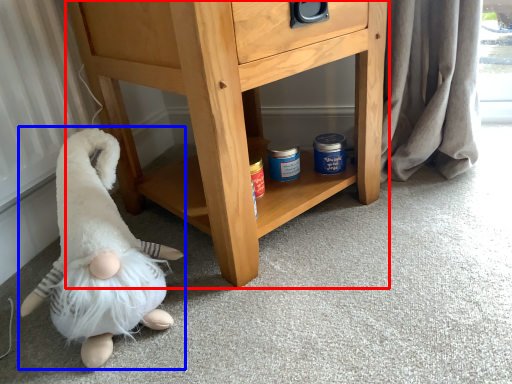
Question: Which of the following is the farthest to the observer, chest of drawers (highlighted by a red box) or toy (highlighted by a blue box)?

Choices:
 (A) chest of drawers
 (B) toy

Answer: (A)